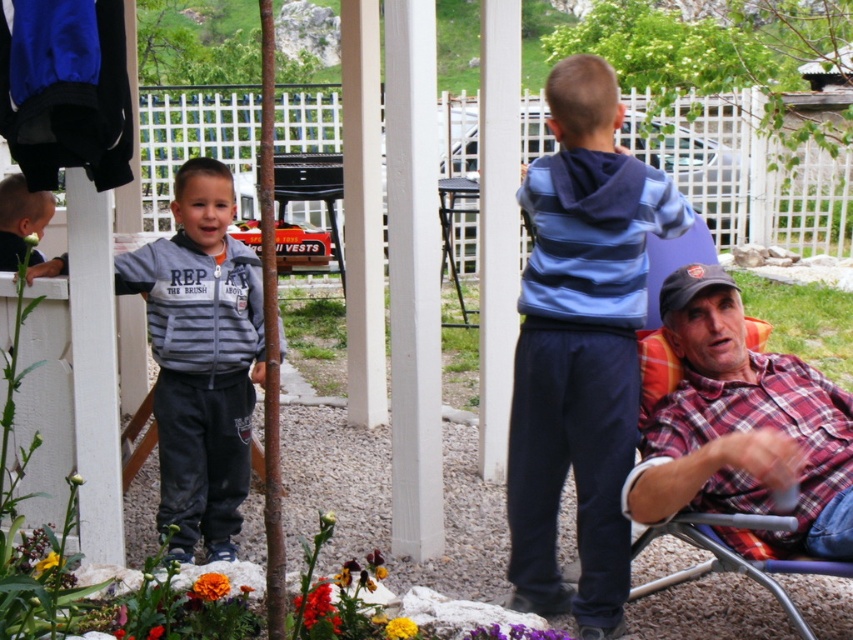
Between bright orange petals at lower center and yellow matte flower at lower left, which one appears on the right side from the viewer's perspective?

bright orange petals at lower center

This screenshot has width=853, height=640. What do you see at coordinates (317, 612) in the screenshot?
I see `bright orange petals at lower center` at bounding box center [317, 612].

Locate an element on the screen. The height and width of the screenshot is (640, 853). bright orange petals at lower center is located at coordinates (317, 612).

What do you see at coordinates (201, 358) in the screenshot? I see `gray fleece jacket at left` at bounding box center [201, 358].

Consider the image. Is gray fleece jacket at left to the right of bright orange petal at center from the viewer's perspective?

In fact, gray fleece jacket at left is to the left of bright orange petal at center.

Where is `gray fleece jacket at left`? gray fleece jacket at left is located at coordinates (201, 358).

The height and width of the screenshot is (640, 853). What are the coordinates of `gray fleece jacket at left` in the screenshot? It's located at (201, 358).

You are a GUI agent. You are given a task and a screenshot of the screen. Output one action in this format:
    pyautogui.click(x=<x>, y=<y>)
    Task: Click on the plaid fabric shirt at lower right
    This screenshot has width=853, height=640.
    Given the screenshot: What is the action you would take?
    pyautogui.click(x=743, y=429)

You are a GUI agent. You are given a task and a screenshot of the screen. Output one action in this format:
    pyautogui.click(x=<x>, y=<y>)
    Task: Click on the plaid fabric shirt at lower right
    The height and width of the screenshot is (640, 853).
    Given the screenshot: What is the action you would take?
    pyautogui.click(x=743, y=429)